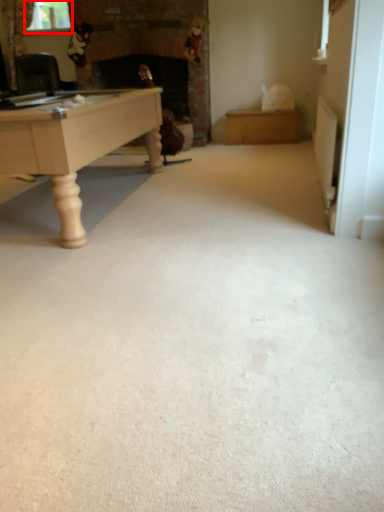
Question: Considering the relative positions of window screen (annotated by the red box) and plain in the image provided, where is window screen (annotated by the red box) located with respect to the staircase?

Choices:
 (A) right
 (B) left

Answer: (B)